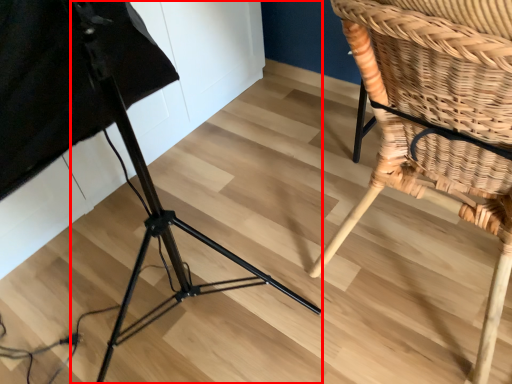
Question: In this image, where is tripod (annotated by the red box) located relative to chair?

Choices:
 (A) right
 (B) left

Answer: (B)